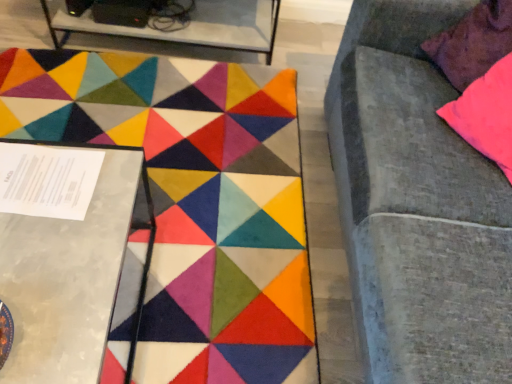
Question: Is velvet gray couch at right next to pink fabric pillow at upper right and touching it?

Choices:
 (A) yes
 (B) no

Answer: (B)

Question: Does velvet gray couch at right contain pink fabric pillow at upper right?

Choices:
 (A) yes
 (B) no

Answer: (A)

Question: Is the depth of velvet gray couch at right less than that of pink fabric pillow at upper right?

Choices:
 (A) yes
 (B) no

Answer: (A)

Question: Considering the relative positions of velvet gray couch at right and pink fabric pillow at upper right in the image provided, is velvet gray couch at right to the left of pink fabric pillow at upper right from the viewer's perspective?

Choices:
 (A) no
 (B) yes

Answer: (A)

Question: Considering the relative sizes of velvet gray couch at right and pink fabric pillow at upper right in the image provided, is velvet gray couch at right shorter than pink fabric pillow at upper right?

Choices:
 (A) no
 (B) yes

Answer: (A)

Question: Is velvet gray couch at right smaller than pink fabric pillow at upper right?

Choices:
 (A) yes
 (B) no

Answer: (B)

Question: Considering the relative sizes of carpet with geometric patterns at center and pink fabric pillow at upper right in the image provided, is carpet with geometric patterns at center taller than pink fabric pillow at upper right?

Choices:
 (A) no
 (B) yes

Answer: (A)

Question: Does carpet with geometric patterns at center have a smaller size compared to pink fabric pillow at upper right?

Choices:
 (A) yes
 (B) no

Answer: (B)

Question: From a real-world perspective, is carpet with geometric patterns at center under pink fabric pillow at upper right?

Choices:
 (A) no
 (B) yes

Answer: (B)

Question: Is carpet with geometric patterns at center at the left side of pink fabric pillow at upper right?

Choices:
 (A) no
 (B) yes

Answer: (B)

Question: Is carpet with geometric patterns at center facing away from pink fabric pillow at upper right?

Choices:
 (A) yes
 (B) no

Answer: (B)

Question: From the image's perspective, is carpet with geometric patterns at center on top of pink fabric pillow at upper right?

Choices:
 (A) yes
 (B) no

Answer: (B)

Question: Could you tell me if carpet with geometric patterns at center is turned towards metallic silver table at left, placed as the first table when sorted from front to back?

Choices:
 (A) no
 (B) yes

Answer: (B)